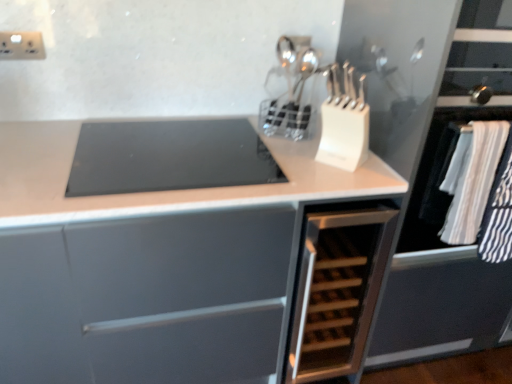
Question: Is white plastic knife block at upper center to the left of white striped fabric at right from the viewer's perspective?

Choices:
 (A) no
 (B) yes

Answer: (B)

Question: Is white plastic knife block at upper center smaller than white striped fabric at right?

Choices:
 (A) yes
 (B) no

Answer: (B)

Question: Is white plastic knife block at upper center beside white striped fabric at right?

Choices:
 (A) no
 (B) yes

Answer: (A)

Question: Does white plastic knife block at upper center lie in front of white striped fabric at right?

Choices:
 (A) yes
 (B) no

Answer: (B)

Question: From a real-world perspective, does white plastic knife block at upper center stand above white striped fabric at right?

Choices:
 (A) no
 (B) yes

Answer: (B)

Question: From a real-world perspective, relative to matte white cabinet at center, the first cabinetry positioned from the left, is white striped fabric at right vertically above or below?

Choices:
 (A) below
 (B) above

Answer: (B)

Question: Looking at their shapes, would you say white striped fabric at right is wider or thinner than matte white cabinet at center, the first cabinetry positioned from the left?

Choices:
 (A) thin
 (B) wide

Answer: (A)

Question: Is white striped fabric at right bigger or smaller than matte white cabinet at center, the first cabinetry positioned from the left?

Choices:
 (A) small
 (B) big

Answer: (A)

Question: In the image, is white striped fabric at right positioned in front of or behind matte white cabinet at center, the first cabinetry positioned from the left?

Choices:
 (A) front
 (B) behind

Answer: (B)

Question: Would you say wooden rack at center, which appears as the first cabinetry when viewed from the right, is inside or outside matte white cabinet at center, acting as the second cabinetry starting from the right?

Choices:
 (A) outside
 (B) inside

Answer: (B)

Question: Is point (361, 238) closer or farther from the camera than point (381, 193)?

Choices:
 (A) closer
 (B) farther

Answer: (B)

Question: Would you say wooden rack at center, which appears as the first cabinetry when viewed from the right, is to the left or to the right of matte white cabinet at center, acting as the second cabinetry starting from the right, in the picture?

Choices:
 (A) right
 (B) left

Answer: (A)

Question: From the image's perspective, is wooden rack at center, the second cabinetry viewed from the left, above or below matte white cabinet at center, acting as the second cabinetry starting from the right?

Choices:
 (A) below
 (B) above

Answer: (A)

Question: From a real-world perspective, is white plastic electric outlet at upper left positioned above or below matte white cabinet at center, the first cabinetry positioned from the left?

Choices:
 (A) below
 (B) above

Answer: (B)

Question: Looking at their shapes, would you say white plastic electric outlet at upper left is wider or thinner than matte white cabinet at center, the first cabinetry positioned from the left?

Choices:
 (A) wide
 (B) thin

Answer: (B)